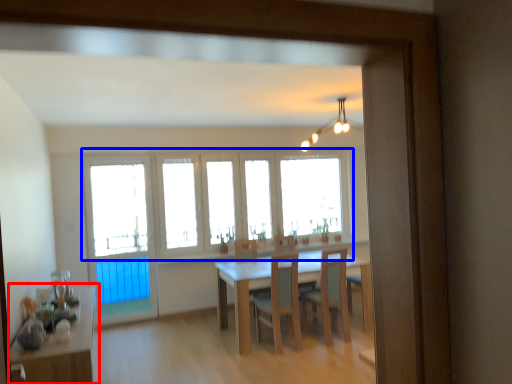
Question: Which object is closer to the camera taking this photo, table (highlighted by a red box) or window (highlighted by a blue box)?

Choices:
 (A) table
 (B) window

Answer: (A)